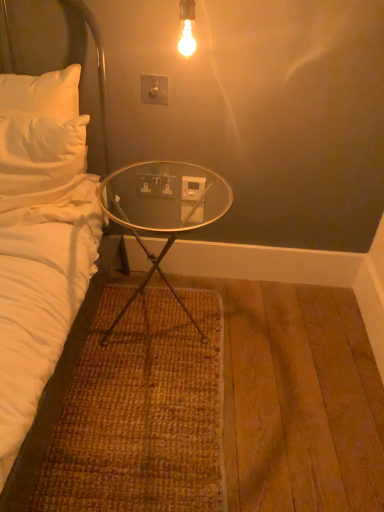
This screenshot has width=384, height=512. I want to click on vacant area that lies to the right of transparent glass table at center, so click(260, 342).